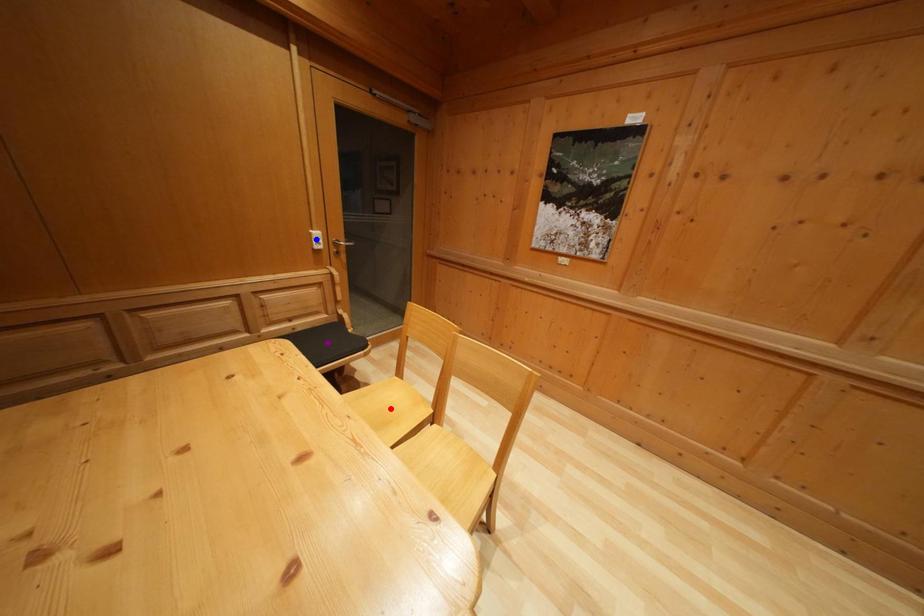
Order these from nearest to farthest:
- purple point
- red point
- blue point

red point < purple point < blue point